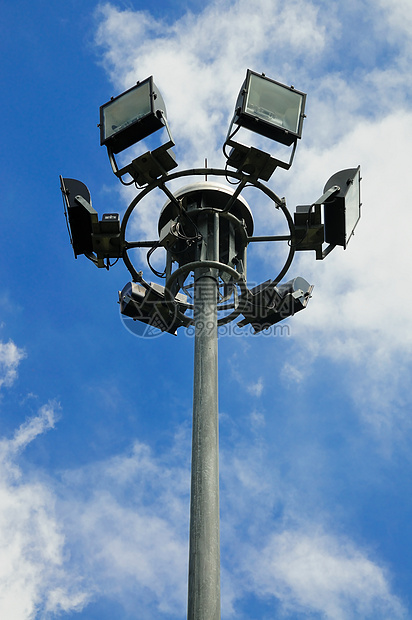
The height and width of the screenshot is (620, 412). Find the location of `lights`. lights is located at coordinates (112, 131), (299, 130), (334, 200), (269, 321), (163, 310), (75, 229).